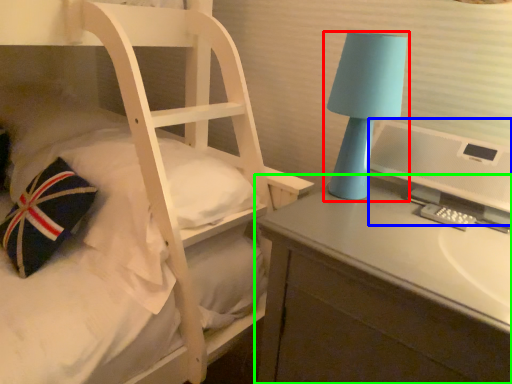
Question: Which object is the farthest from lamp (highlighted by a red box)? Choose among these: computer monitor (highlighted by a blue box) or desk (highlighted by a green box).

Choices:
 (A) computer monitor
 (B) desk

Answer: (B)